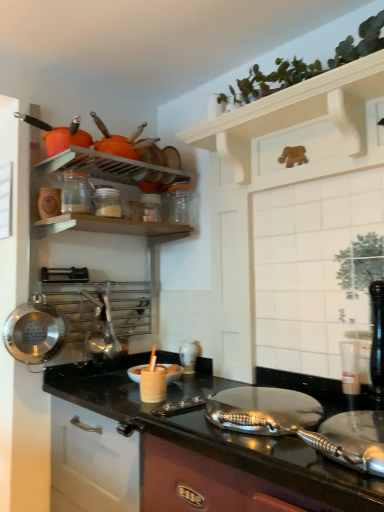
Question: Considering the positions of point (104, 212) and point (44, 352), is point (104, 212) closer or farther from the camera than point (44, 352)?

Choices:
 (A) closer
 (B) farther

Answer: (A)

Question: From the image's perspective, is clear glass jar at upper center, which is the 2th appliance in bottom-to-top order, above or below polished stainless steel wok at left?

Choices:
 (A) below
 (B) above

Answer: (B)

Question: Estimate the real-world distances between objects in this image. Which object is farther from the green leafy plant at upper right?

Choices:
 (A) polished stainless steel wok at left
 (B) clear glass jar at upper left, arranged as the 3th appliance when ordered from the bottom
 (C) white wooden shelf at upper center
 (D) white glossy vase at center, the 3th appliance from the top
 (E) metallic black countertop at center

Answer: (A)

Question: Which object is positioned farthest from the green leafy plant at upper right?

Choices:
 (A) clear glass jar at upper center, which is counted as the second appliance, starting from the left
 (B) white wooden shelf at upper center
 (C) clear glass jar at upper left, marked as the first appliance in a front-to-back arrangement
 (D) metallic black countertop at center
 (E) polished stainless steel wok at left

Answer: (E)